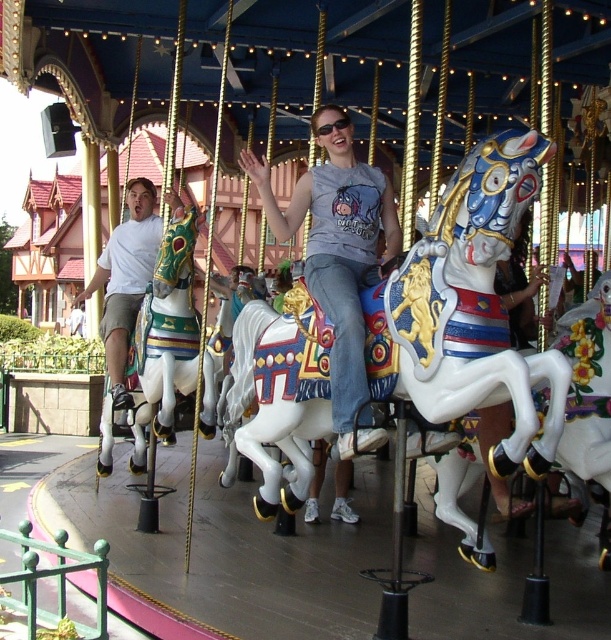
Question: Which object is the farthest from the white glossy horse at center?

Choices:
 (A) white matte shirt at left
 (B) matte gray shirt at center
 (C) white glossy horse at left

Answer: (A)

Question: Does white glossy horse at center come in front of matte gray shirt at center?

Choices:
 (A) yes
 (B) no

Answer: (A)

Question: Which of the following is the farthest from the observer?

Choices:
 (A) click(x=315, y=259)
 (B) click(x=114, y=257)
 (C) click(x=403, y=294)
 (D) click(x=210, y=432)

Answer: (B)

Question: Does white glossy horse at center appear under white glossy horse at left?

Choices:
 (A) yes
 (B) no

Answer: (B)

Question: Which point is closer to the camera?

Choices:
 (A) (345, 301)
 (B) (125, 397)
 (C) (158, 387)

Answer: (A)

Question: Is white glossy horse at center to the right of white glossy horse at left from the viewer's perspective?

Choices:
 (A) yes
 (B) no

Answer: (A)